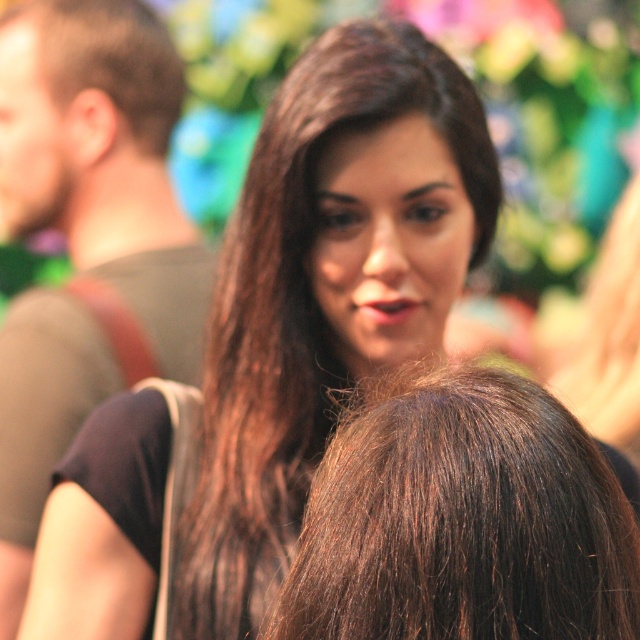
Is brown shiny hair at center taller than brown shiny hair at upper left?

In fact, brown shiny hair at center may be shorter than brown shiny hair at upper left.

Who is shorter, brown shiny hair at center or brown shiny hair at upper left?

brown shiny hair at center is shorter.

Find the location of `brown shiny hair at center`. brown shiny hair at center is located at coordinates (464, 518).

Is brown shiny hair at center taller than brown hair at upper left?

No, brown shiny hair at center is not taller than brown hair at upper left.

Who is higher up, brown shiny hair at center or brown hair at upper left?

brown hair at upper left

Which is behind, point (365, 445) or point (19, 305)?

Positioned behind is point (19, 305).

Identify the location of brown shiny hair at center. (464, 518).

Is brown hair at upper left to the right of brown shiny hair at upper left from the viewer's perspective?

Indeed, brown hair at upper left is positioned on the right side of brown shiny hair at upper left.

Does brown hair at upper left have a lesser height compared to brown shiny hair at upper left?

No.

Between point (147, 256) and point (154, 124), which one is positioned in front?

Positioned in front is point (147, 256).

Locate an element on the screen. The height and width of the screenshot is (640, 640). brown hair at upper left is located at coordinates (104, 160).